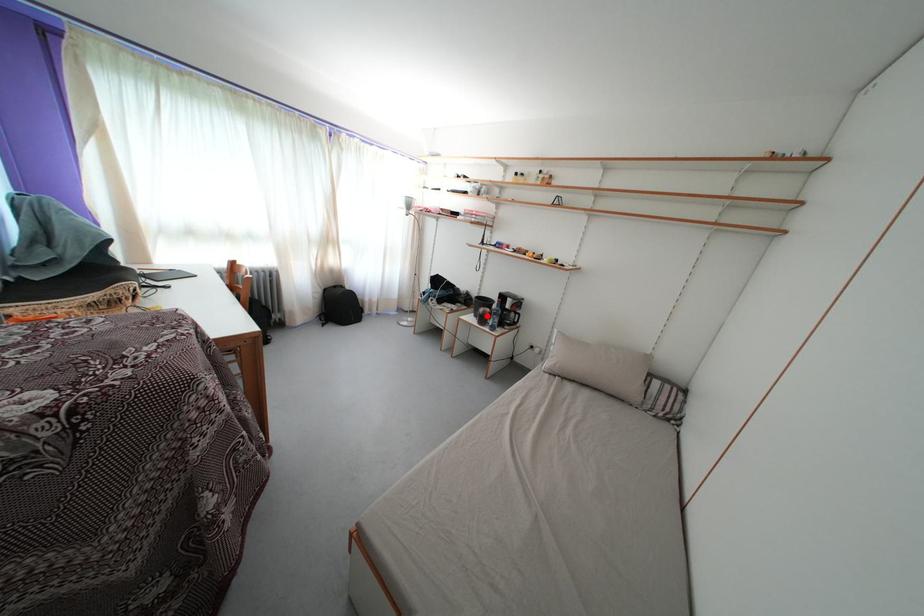
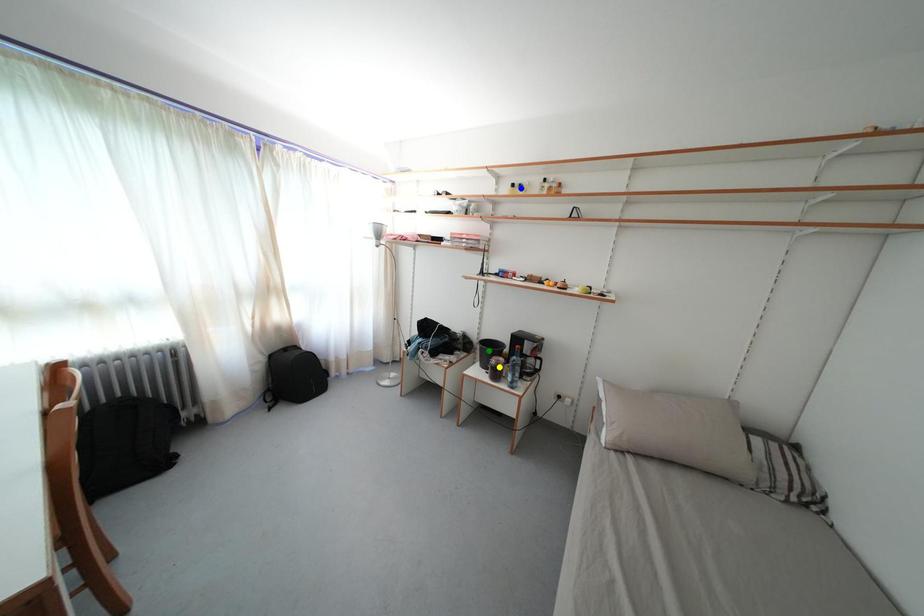
Question: I am providing you with two images of the same scene from different viewpoints. A red point is marked on the first image. You are given multiple points on the second image. Which point in image 2 represents the same 3d spot as the red point in image 1?

Choices:
 (A) yellow point
 (B) green point
 (C) blue point

Answer: (A)